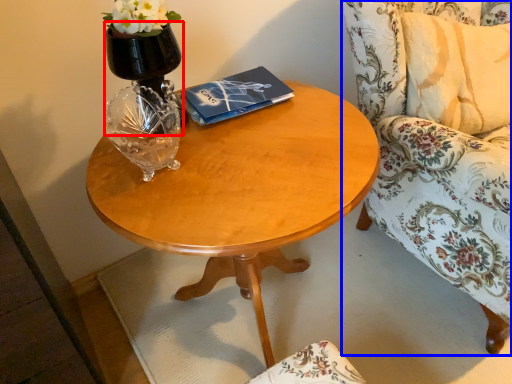
Question: Which of the following is the closest to the observer, vase (highlighted by a red box) or chair (highlighted by a blue box)?

Choices:
 (A) vase
 (B) chair

Answer: (B)